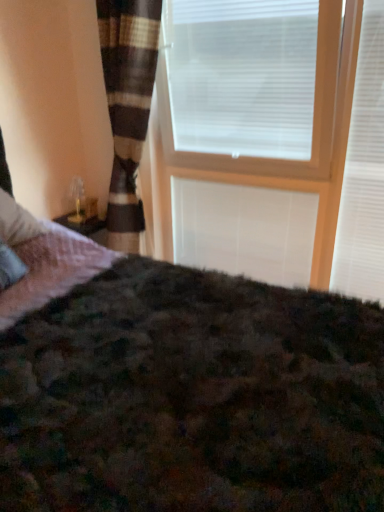
Question: Looking at their shapes, would you say white matte window blind at upper right, which ranks as the 2th window blind in left-to-right order, is wider or thinner than white matte blind at center?

Choices:
 (A) wide
 (B) thin

Answer: (A)

Question: Is white matte window blind at upper right, placed as the first window blind when sorted from right to left, situated inside white matte blind at center or outside?

Choices:
 (A) inside
 (B) outside

Answer: (B)

Question: Based on their relative distances, which object is nearer to the white matte window blind at upper right, which ranks as the 2th window blind in left-to-right order?

Choices:
 (A) white matte blind at center
 (B) wooden frame at upper center
 (C) white plastic blinds at upper center, the 2th window blind viewed from the right

Answer: (B)

Question: Considering the real-world distances, which object is closest to the white matte blind at center?

Choices:
 (A) white matte window blind at upper right, placed as the first window blind when sorted from right to left
 (B) wooden frame at upper center
 (C) white plastic blinds at upper center, which is the first window blind from left to right

Answer: (B)